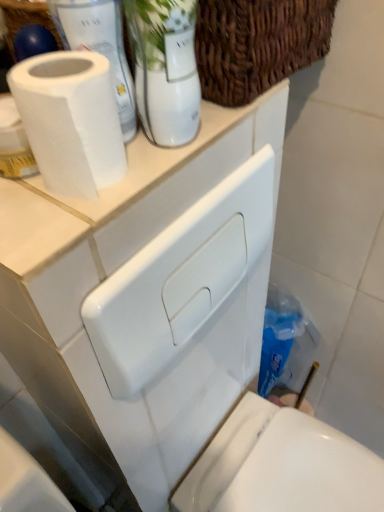
Identify the location of white matte toilet paper at upper left. (70, 120).

This screenshot has height=512, width=384. What do you see at coordinates (99, 46) in the screenshot?
I see `white matte paper towel at upper left` at bounding box center [99, 46].

Locate an element on the screen. This screenshot has height=512, width=384. white glossy toilet at lower right is located at coordinates tap(281, 466).

What do you see at coordinates (281, 466) in the screenshot? Image resolution: width=384 pixels, height=512 pixels. I see `white glossy toilet at lower right` at bounding box center [281, 466].

Locate an element on the screen. This screenshot has height=512, width=384. white glossy glass vase at upper center is located at coordinates (165, 68).

What is the approximate width of white glossy glass vase at upper center?

white glossy glass vase at upper center is 5.31 centimeters wide.

The width and height of the screenshot is (384, 512). In order to click on white matte toilet paper at upper left in this screenshot , I will do `click(70, 120)`.

In terms of height, does white glossy glass vase at upper center look taller or shorter compared to woven brown basket at upper center?

white glossy glass vase at upper center is taller than woven brown basket at upper center.

Which object is further away from the camera, white glossy glass vase at upper center or woven brown basket at upper center?

woven brown basket at upper center is more distant.

Considering the points (165, 118) and (239, 91), which point is behind, point (165, 118) or point (239, 91)?

Positioned behind is point (239, 91).

Is white glossy glass vase at upper center bigger than woven brown basket at upper center?

No.

Between white matte toilet paper at upper left and white glossy toilet at lower right, which one appears on the left side from the viewer's perspective?

Positioned to the left is white matte toilet paper at upper left.

Between point (53, 121) and point (263, 505), which one is positioned in front?

Point (53, 121)

Can you confirm if white matte toilet paper at upper left is shorter than white glossy toilet at lower right?

Yes.

Measure the distance from white matte toilet paper at upper left to white glossy toilet at lower right.

The distance of white matte toilet paper at upper left from white glossy toilet at lower right is 29.57 inches.

Consider the image. From a real-world perspective, is white glossy toilet at lower right above or below white matte counter top at upper center?

From a real-world perspective, white glossy toilet at lower right is physically below white matte counter top at upper center.

Is white glossy toilet at lower right aimed at white matte counter top at upper center?

No, white glossy toilet at lower right does not turn towards white matte counter top at upper center.

How many degrees apart are the facing directions of white glossy toilet at lower right and white matte counter top at upper center?

They differ by 0.216 degrees in their facing directions.

From a real-world perspective, between white matte paper towel at upper left and blue plastic bottle at lower right, who is vertically higher?

In real-world perspective, white matte paper towel at upper left is above.

From the image's perspective, is white matte paper towel at upper left below blue plastic bottle at lower right?

No.

Can you tell me how much white matte paper towel at upper left and blue plastic bottle at lower right differ in facing direction?

0.217 degrees.

Can you confirm if white matte paper towel at upper left is shorter than blue plastic bottle at lower right?

Correct, white matte paper towel at upper left is not as tall as blue plastic bottle at lower right.

Is white matte toilet paper at upper left not near blue plastic bottle at lower right?

They are positioned close to each other.

Which of these two, white matte toilet paper at upper left or blue plastic bottle at lower right, is bigger?

Bigger between the two is blue plastic bottle at lower right.

From a real-world perspective, who is located lower, white matte toilet paper at upper left or blue plastic bottle at lower right?

From a 3D spatial view, blue plastic bottle at lower right is below.

From the picture: From the image's perspective, relative to blue plastic bottle at lower right, is white matte toilet paper at upper left above or below?

white matte toilet paper at upper left is above blue plastic bottle at lower right.

Is white glossy toilet at lower right aimed at white glossy glass vase at upper center?

No, white glossy toilet at lower right does not turn towards white glossy glass vase at upper center.

Looking at this image, is white glossy toilet at lower right taller than white glossy glass vase at upper center?

Indeed, white glossy toilet at lower right has a greater height compared to white glossy glass vase at upper center.

Does white glossy toilet at lower right appear on the right side of white glossy glass vase at upper center?

Correct, you'll find white glossy toilet at lower right to the right of white glossy glass vase at upper center.

Considering the positions of points (219, 496) and (154, 109), is point (219, 496) closer to camera compared to point (154, 109)?

No, (219, 496) is further to viewer.

Considering the sizes of blue plastic bottle at lower right and white glossy glass vase at upper center in the image, is blue plastic bottle at lower right wider or thinner than white glossy glass vase at upper center?

blue plastic bottle at lower right is wider than white glossy glass vase at upper center.

Which is less distant, (285, 356) or (141, 2)?

The point (141, 2) is closer to the camera.

Is blue plastic bottle at lower right next to white glossy glass vase at upper center and touching it?

No, blue plastic bottle at lower right is not beside white glossy glass vase at upper center.

Can we say blue plastic bottle at lower right lies outside white glossy glass vase at upper center?

blue plastic bottle at lower right lies outside white glossy glass vase at upper center's area.

Where is `basket that is above the white glossy glass vase at upper center (from the image's perspective)`? This screenshot has height=512, width=384. basket that is above the white glossy glass vase at upper center (from the image's perspective) is located at coordinates (257, 44).

At what (x,y) coordinates should I click in order to perform the action: click on toilet paper positioned vertically above the white glossy toilet at lower right (from a real-world perspective). Please return your answer as a coordinate pair (x, y). The image size is (384, 512). Looking at the image, I should click on (70, 120).

Based on their spatial positions, is woven brown basket at upper center or white glossy glass vase at upper center closer to white glossy toilet at lower right?

white glossy glass vase at upper center is positioned closer to the anchor white glossy toilet at lower right.

From the image, which object appears to be farther from woven brown basket at upper center, white glossy glass vase at upper center or white matte counter top at upper center?

Based on the image, white glossy glass vase at upper center appears to be further to woven brown basket at upper center.

From the picture: When comparing their distances from white glossy glass vase at upper center, does white matte toilet paper at upper left or white glossy toilet at lower right seem closer?

Among the two, white matte toilet paper at upper left is located nearer to white glossy glass vase at upper center.

From the image, which object appears to be farther from woven brown basket at upper center, white glossy glass vase at upper center or blue plastic bottle at lower right?

blue plastic bottle at lower right lies further to woven brown basket at upper center than the other object.

When comparing their distances from white glossy toilet at lower right, does woven brown basket at upper center or white matte counter top at upper center seem closer?

white matte counter top at upper center is closer to white glossy toilet at lower right.

When comparing their distances from woven brown basket at upper center, does white glossy toilet at lower right or white matte paper towel at upper left seem further?

white glossy toilet at lower right is further to woven brown basket at upper center.

From the image, which object appears to be nearer to white matte toilet paper at upper left, white matte paper towel at upper left or blue plastic bottle at lower right?

white matte paper towel at upper left.

When comparing their distances from white matte counter top at upper center, does white glossy toilet at lower right or white matte toilet paper at upper left seem closer?

Among the two, white matte toilet paper at upper left is located nearer to white matte counter top at upper center.

Locate an element on the screen. The height and width of the screenshot is (512, 384). cleaning product that lies between white matte toilet paper at upper left and white glossy toilet at lower right from top to bottom is located at coordinates (285, 343).

At what (x,y) coordinates should I click in order to perform the action: click on counter top between woven brown basket at upper center and white glossy toilet at lower right in the vertical direction. Please return your answer as a coordinate pair (x, y). Looking at the image, I should click on (125, 183).

Identify the location of counter top between white matte paper towel at upper left and white matte toilet paper at upper left vertically. (125, 183).

I want to click on glass vase between white matte paper towel at upper left and woven brown basket at upper center in the horizontal direction, so click(165, 68).